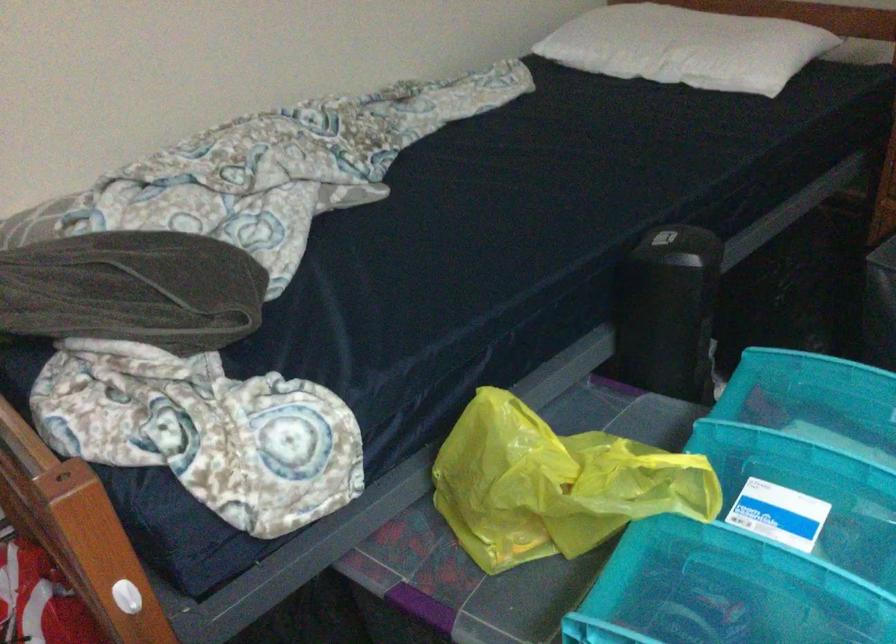
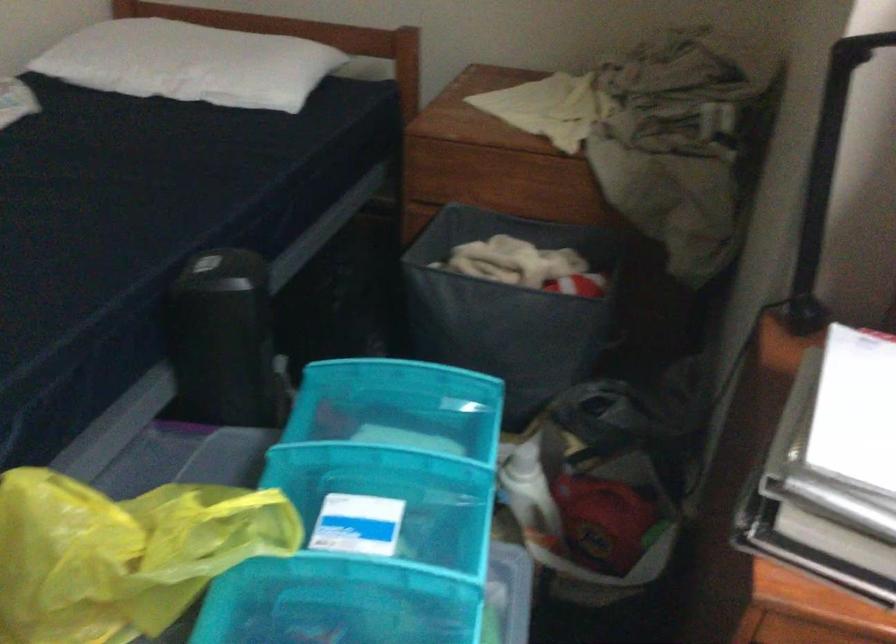
Find the pixel in the second image that matches (682,243) in the first image.

(225, 268)